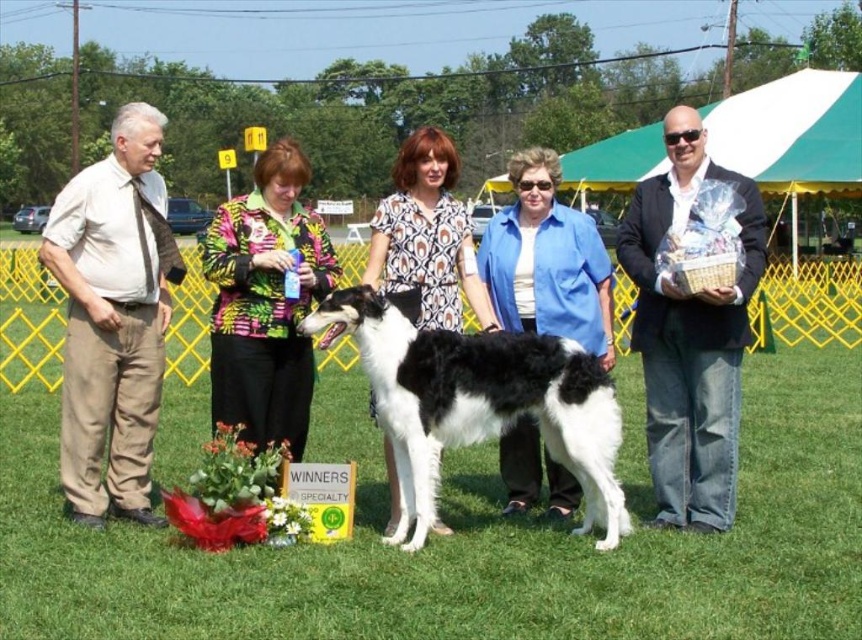
Question: Can you confirm if beige cotton pants at left is thinner than black and white fur at center?

Choices:
 (A) yes
 (B) no

Answer: (B)

Question: Is the position of beige cotton pants at left less distant than that of black and white fur at center?

Choices:
 (A) no
 (B) yes

Answer: (A)

Question: Among these points, which one is farthest from the camera?

Choices:
 (A) (736, 353)
 (B) (476, 385)
 (C) (97, 493)

Answer: (C)

Question: Does beige cotton pants at left have a greater width compared to black and white fur at center?

Choices:
 (A) yes
 (B) no

Answer: (A)

Question: Which of the following is the farthest from the observer?

Choices:
 (A) (x=696, y=529)
 (B) (x=448, y=408)

Answer: (A)

Question: Which object is closer to the camera taking this photo?

Choices:
 (A) black and white fur at center
 (B) beige cotton pants at left

Answer: (A)